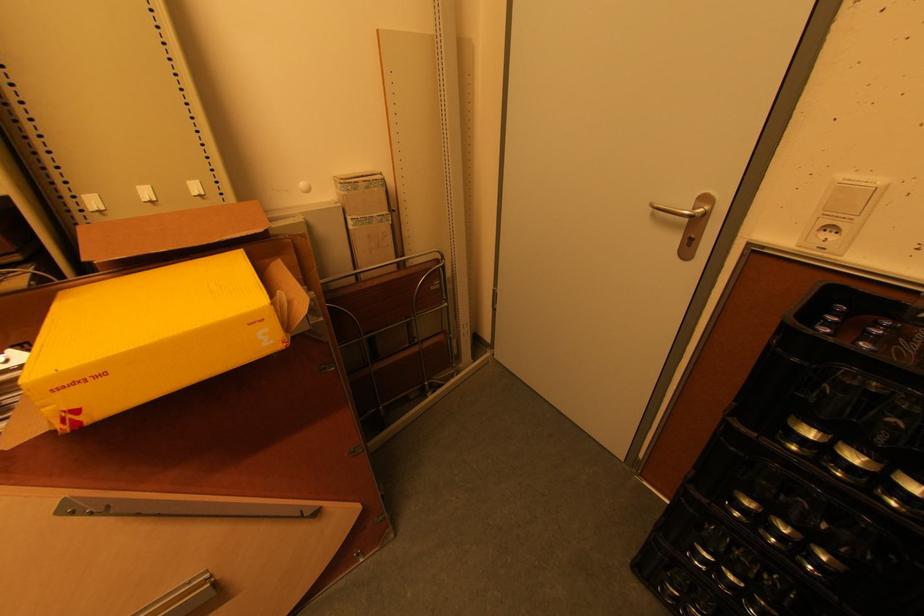
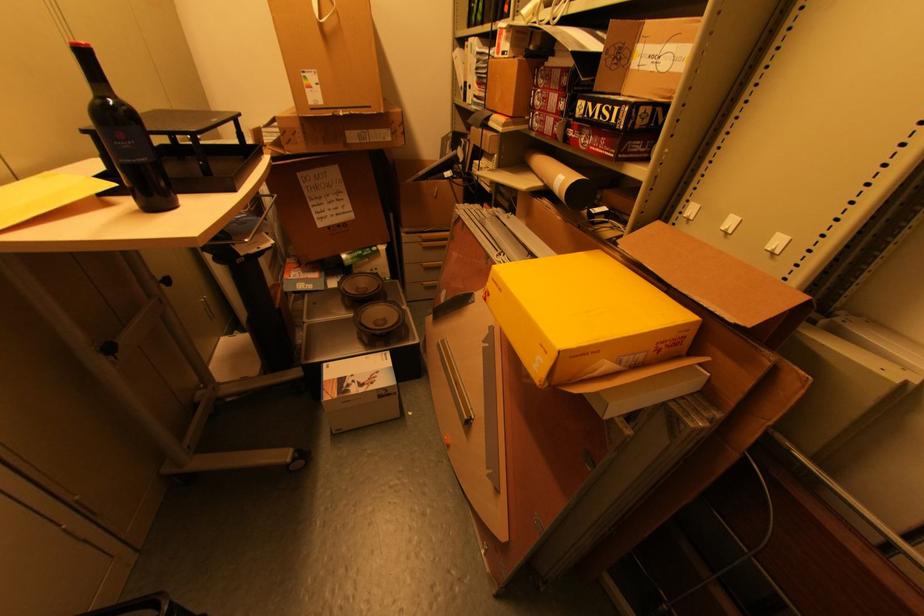
Where in the second image is the point corresponding to point 78,384 from the first image?

(499, 284)